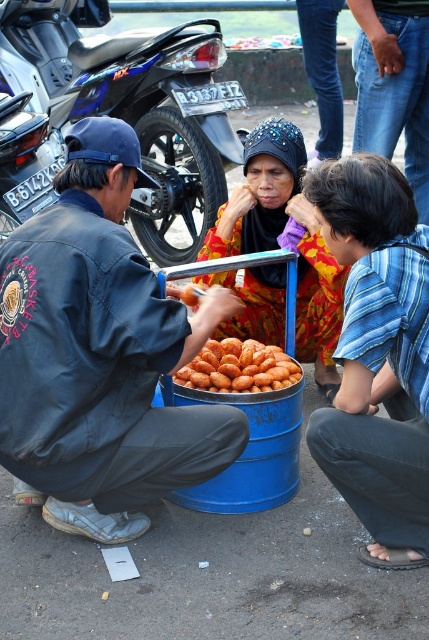
Question: From the image, what is the correct spatial relationship of blue striped shirt at lower right in relation to golden fried snack at center?

Choices:
 (A) below
 (B) above

Answer: (B)

Question: Can you confirm if floral fabric headscarf at center is smaller than golden fried snack at center?

Choices:
 (A) yes
 (B) no

Answer: (B)

Question: Which point is closer to the camera taking this photo?

Choices:
 (A) (295, 344)
 (B) (360, 211)
 (C) (108, 483)
 (D) (196, 51)

Answer: (B)

Question: Based on their relative distances, which object is farther from the matte black jacket at left?

Choices:
 (A) floral fabric headscarf at center
 (B) jeans at center

Answer: (B)

Question: Does black glossy motorcycle at upper left appear under jeans at center?

Choices:
 (A) yes
 (B) no

Answer: (B)

Question: Among these points, which one is nearest to the camera?

Choices:
 (A) (51, 282)
 (B) (268, 381)
 (C) (97, 51)

Answer: (A)